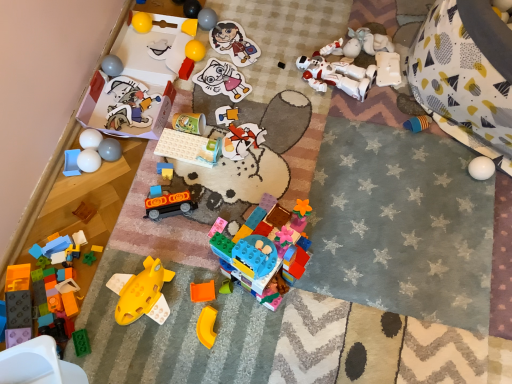
The height and width of the screenshot is (384, 512). I want to click on empty space that is in between matte plastic sticker at upper center, which is the 20th toy from left to right, and white plastic robot at upper right, arranged as the 22th toy when viewed from the left, so click(281, 58).